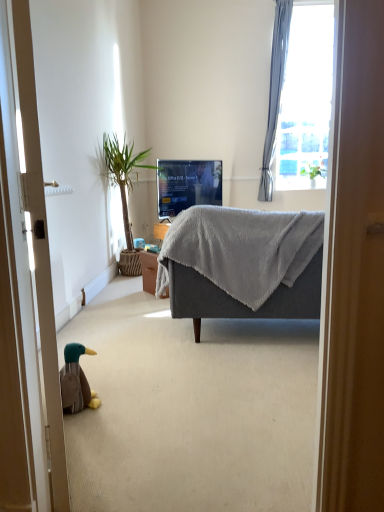
Locate an element on the screen. The height and width of the screenshot is (512, 384). vacant area in front of gray soft fabric couch at center is located at coordinates (227, 406).